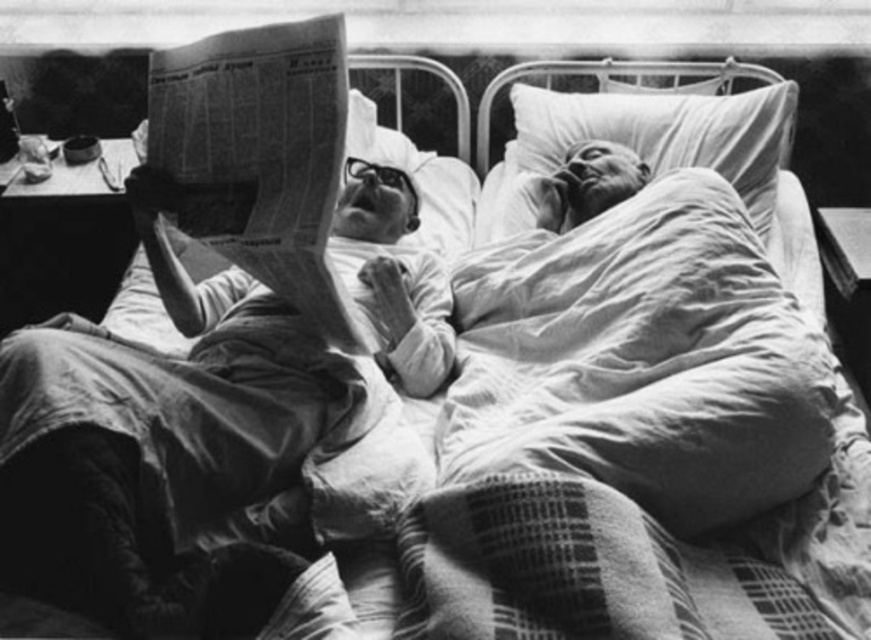
Who is more distant from viewer, (181,88) or (559,124)?

The point (559,124) is more distant.

Does printed newspaper at upper left have a smaller size compared to white soft pillow at upper right?

Yes, printed newspaper at upper left is smaller than white soft pillow at upper right.

What are the coordinates of `printed newspaper at upper left` in the screenshot? It's located at (258, 154).

At what (x,y) coordinates should I click in order to perform the action: click on printed newspaper at upper left. Please return your answer as a coordinate pair (x, y). The height and width of the screenshot is (640, 871). Looking at the image, I should click on (258, 154).

Does smooth paper newspaper at upper left have a smaller size compared to white soft pillow at upper right?

Actually, smooth paper newspaper at upper left might be larger than white soft pillow at upper right.

Which of these two, smooth paper newspaper at upper left or white soft pillow at upper right, stands taller?

Standing taller between the two is smooth paper newspaper at upper left.

Does point (145, 550) come closer to viewer compared to point (733, 184)?

Yes.

Find the location of `smooth paper newspaper at upper left`. smooth paper newspaper at upper left is located at coordinates (161, 440).

Between smooth paper newspaper at upper left and smooth skin face at upper right, which one is positioned lower?

smooth paper newspaper at upper left is below.

Locate an element on the screen. The image size is (871, 640). smooth paper newspaper at upper left is located at coordinates (161, 440).

Where is `smooth paper newspaper at upper left`? The width and height of the screenshot is (871, 640). smooth paper newspaper at upper left is located at coordinates (161, 440).